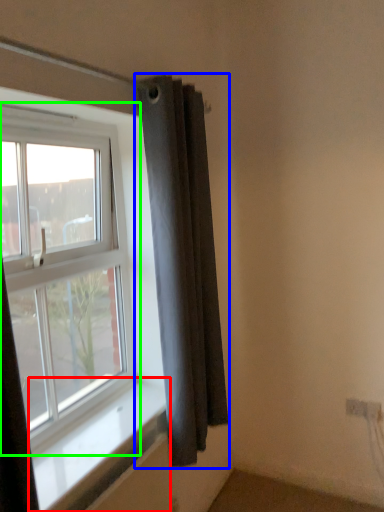
Question: Estimate the real-world distances between objects in this image. Which object is closer to window sill (highlighted by a red box), curtain (highlighted by a blue box) or window (highlighted by a green box)?

Choices:
 (A) curtain
 (B) window

Answer: (B)